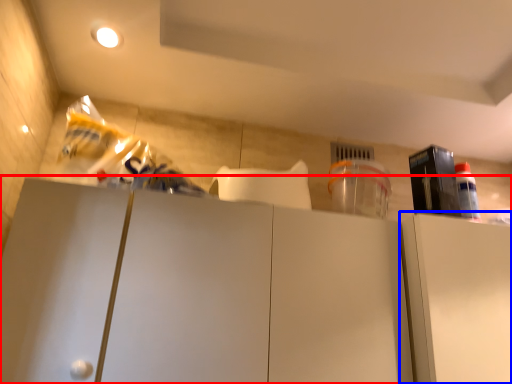
Question: Which of the following is the closest to the observer, cabinetry (highlighted by a red box) or cabinetry (highlighted by a blue box)?

Choices:
 (A) cabinetry
 (B) cabinetry

Answer: (A)